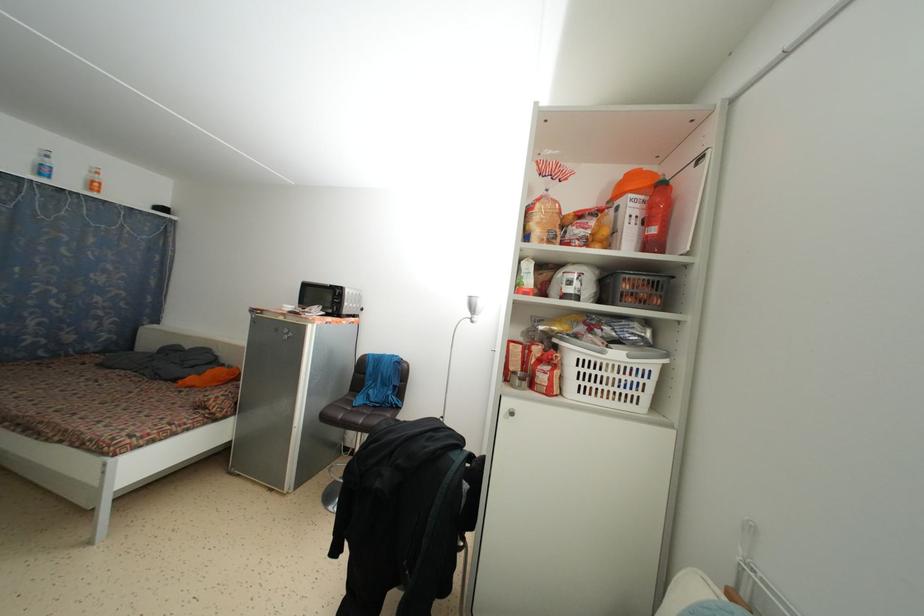
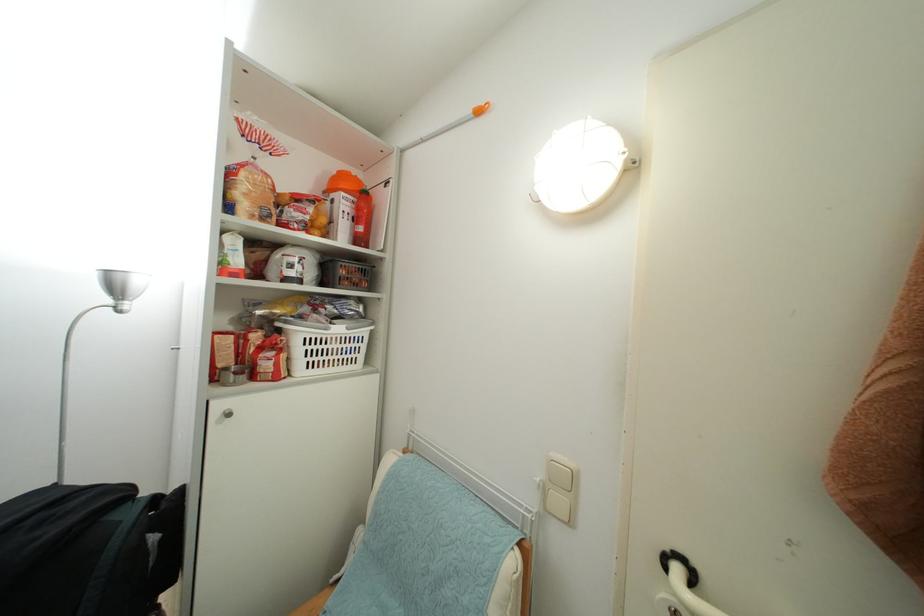
Locate, in the second image, the point that corresponds to (606,358) in the first image.

(331, 334)